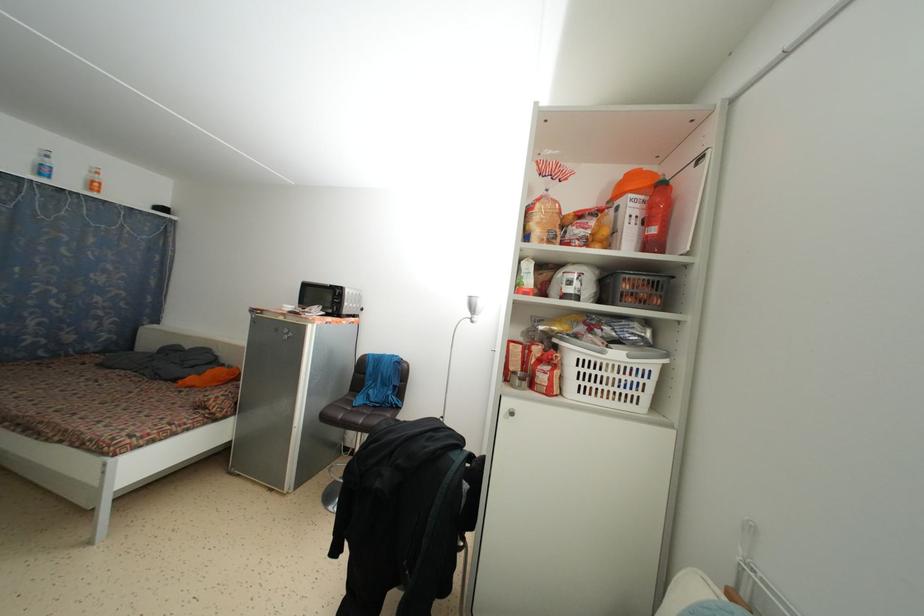
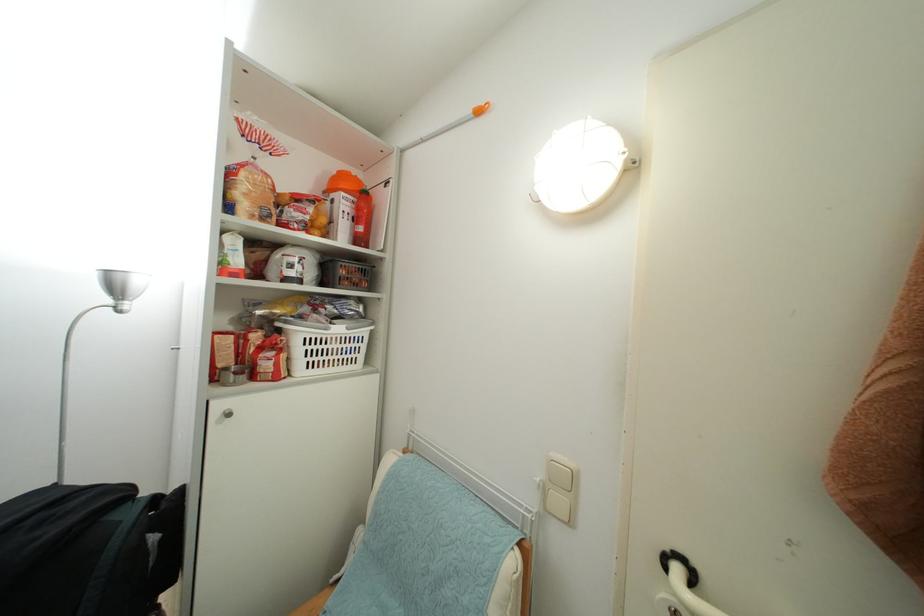
Locate, in the second image, the point that corresponds to (606,358) in the first image.

(331, 334)